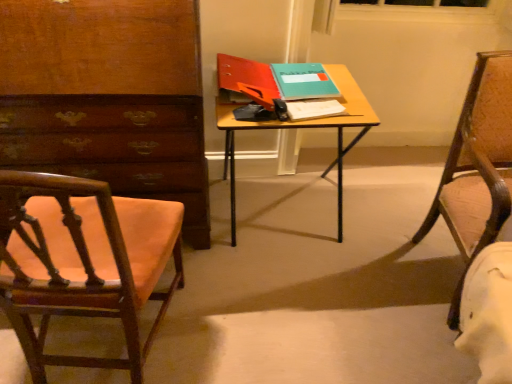
What do you see at coordinates (477, 167) in the screenshot?
I see `leather-like brown chair at right, which is the second chair from left to right` at bounding box center [477, 167].

Find the location of `matte red folder at center, which is the first book in left-to-right order`. matte red folder at center, which is the first book in left-to-right order is located at coordinates (243, 73).

Where is `teal matte book at center, the 2th book from the left`? This screenshot has width=512, height=384. teal matte book at center, the 2th book from the left is located at coordinates tap(303, 81).

Is leather-like brown chair at right, the first chair from the right, shorter than wooden chair at left, marked as the 2th chair in a right-to-left arrangement?

In fact, leather-like brown chair at right, the first chair from the right, may be taller than wooden chair at left, marked as the 2th chair in a right-to-left arrangement.

Is leather-like brown chair at right, the first chair from the right, thinner than wooden chair at left, marked as the 2th chair in a right-to-left arrangement?

In fact, leather-like brown chair at right, the first chair from the right, might be wider than wooden chair at left, marked as the 2th chair in a right-to-left arrangement.

From the image's perspective, is leather-like brown chair at right, the first chair from the right, located beneath wooden chair at left, acting as the first chair starting from the left?

No, from the image's perspective, leather-like brown chair at right, the first chair from the right, is not beneath wooden chair at left, acting as the first chair starting from the left.

Is leather-like brown chair at right, the first chair from the right, bigger than wooden chair at left, acting as the first chair starting from the left?

Yes, leather-like brown chair at right, the first chair from the right, is bigger than wooden chair at left, acting as the first chair starting from the left.

From the image's perspective, is teal matte book at center, acting as the 1th book starting from the right, located above or below matte red folder at center, the 2th book viewed from the right?

Clearly, from the image's perspective, teal matte book at center, acting as the 1th book starting from the right, is above matte red folder at center, the 2th book viewed from the right.

Could matte red folder at center, which is the first book in left-to-right order, be considered to be inside teal matte book at center, the 2th book from the left?

No, matte red folder at center, which is the first book in left-to-right order, is not inside teal matte book at center, the 2th book from the left.

Is teal matte book at center, acting as the 1th book starting from the right, not close to matte red folder at center, which is the first book in left-to-right order?

No, teal matte book at center, acting as the 1th book starting from the right, is in close proximity to matte red folder at center, which is the first book in left-to-right order.

From the picture: From a real-world perspective, is teal matte book at center, acting as the 1th book starting from the right, positioned under matte red folder at center, the 2th book viewed from the right, based on gravity?

Correct, in the physical world, teal matte book at center, acting as the 1th book starting from the right, is lower than matte red folder at center, the 2th book viewed from the right.

Between matte red folder at center, the 2th book viewed from the right, and wooden desk at center, which one is positioned behind?

matte red folder at center, the 2th book viewed from the right, is further away from the camera.

Locate an element on the screen. the 1st book behind the wooden desk at center, counting from the anchor's position is located at coordinates (243, 73).

From the picture: In terms of height, does matte red folder at center, which is the first book in left-to-right order, look taller or shorter compared to wooden desk at center?

In the image, matte red folder at center, which is the first book in left-to-right order, appears to be shorter than wooden desk at center.

Based on the photo, how far apart are matte red folder at center, the 2th book viewed from the right, and white paper notepad at center?

A distance of 9.64 inches exists between matte red folder at center, the 2th book viewed from the right, and white paper notepad at center.

Is point (247, 83) more distant than point (331, 105)?

Yes.

Between matte red folder at center, which is the first book in left-to-right order, and white paper notepad at center, which one has more height?

With more height is matte red folder at center, which is the first book in left-to-right order.

From a real-world perspective, is matte red folder at center, which is the first book in left-to-right order, positioned under white paper notepad at center based on gravity?

No, from a real-world perspective, matte red folder at center, which is the first book in left-to-right order, is not below white paper notepad at center.

Is the depth of matte red folder at center, the 2th book viewed from the right, greater than that of wooden chair at left, acting as the first chair starting from the left?

Yes, matte red folder at center, the 2th book viewed from the right, is behind wooden chair at left, acting as the first chair starting from the left.

Based on the photo, is matte red folder at center, the 2th book viewed from the right, thinner than wooden chair at left, marked as the 2th chair in a right-to-left arrangement?

Indeed, matte red folder at center, the 2th book viewed from the right, has a lesser width compared to wooden chair at left, marked as the 2th chair in a right-to-left arrangement.

Is matte red folder at center, which is the first book in left-to-right order, not near wooden chair at left, marked as the 2th chair in a right-to-left arrangement?

matte red folder at center, which is the first book in left-to-right order, is actually quite close to wooden chair at left, marked as the 2th chair in a right-to-left arrangement.

Between matte red folder at center, which is the first book in left-to-right order, and teal matte book at center, the 2th book from the left, which one is positioned in front?

matte red folder at center, which is the first book in left-to-right order.

Considering the sizes of objects matte red folder at center, which is the first book in left-to-right order, and teal matte book at center, acting as the 1th book starting from the right, in the image provided, who is wider, matte red folder at center, which is the first book in left-to-right order, or teal matte book at center, acting as the 1th book starting from the right,?

matte red folder at center, which is the first book in left-to-right order, is wider.

Could you measure the distance between matte red folder at center, the 2th book viewed from the right, and teal matte book at center, the 2th book from the left?

The distance of matte red folder at center, the 2th book viewed from the right, from teal matte book at center, the 2th book from the left, is 5.04 inches.

In the scene shown: How different are the orientations of teal matte book at center, acting as the 1th book starting from the right, and white paper notepad at center in degrees?

The angular difference between teal matte book at center, acting as the 1th book starting from the right, and white paper notepad at center is 8.08 degrees.

From a real-world perspective, between teal matte book at center, the 2th book from the left, and white paper notepad at center, who is vertically lower?

white paper notepad at center is physically lower.

Relative to white paper notepad at center, is teal matte book at center, the 2th book from the left, in front or behind?

teal matte book at center, the 2th book from the left, is positioned farther from the viewer than white paper notepad at center.

Measure the distance from teal matte book at center, acting as the 1th book starting from the right, to white paper notepad at center.

A distance of 12.37 centimeters exists between teal matte book at center, acting as the 1th book starting from the right, and white paper notepad at center.

Where is `chair on the left of leather-like brown chair at right, the first chair from the right`? The width and height of the screenshot is (512, 384). chair on the left of leather-like brown chair at right, the first chair from the right is located at coordinates (83, 261).

Where is `book positioned vertically above the teal matte book at center, acting as the 1th book starting from the right (from a real-world perspective)`? This screenshot has height=384, width=512. book positioned vertically above the teal matte book at center, acting as the 1th book starting from the right (from a real-world perspective) is located at coordinates (243, 73).

Which object lies further to the anchor point matte red folder at center, which is the first book in left-to-right order, wooden chair at left, marked as the 2th chair in a right-to-left arrangement, or leather-like brown chair at right, which is the second chair from left to right?

Based on the image, leather-like brown chair at right, which is the second chair from left to right, appears to be further to matte red folder at center, which is the first book in left-to-right order.

Considering their positions, is leather-like brown chair at right, which is the second chair from left to right, positioned further to white paper notepad at center than matte red folder at center, the 2th book viewed from the right?

leather-like brown chair at right, which is the second chair from left to right, lies further to white paper notepad at center than the other object.

Looking at the image, which one is located further to white paper notepad at center, matte red folder at center, which is the first book in left-to-right order, or leather-like brown chair at right, the first chair from the right?

leather-like brown chair at right, the first chair from the right, lies further to white paper notepad at center than the other object.

Based on the photo, based on their spatial positions, is wooden desk at center or white paper notepad at center closer to leather-like brown chair at right, which is the second chair from left to right?

The object closer to leather-like brown chair at right, which is the second chair from left to right, is wooden desk at center.

From the image, which object appears to be nearer to wooden chair at left, marked as the 2th chair in a right-to-left arrangement, leather-like brown chair at right, the first chair from the right, or teal matte book at center, acting as the 1th book starting from the right?

teal matte book at center, acting as the 1th book starting from the right, is closer to wooden chair at left, marked as the 2th chair in a right-to-left arrangement.

Based on their spatial positions, is matte red folder at center, which is the first book in left-to-right order, or wooden desk at center closer to teal matte book at center, the 2th book from the left?

The object closer to teal matte book at center, the 2th book from the left, is matte red folder at center, which is the first book in left-to-right order.

Looking at the image, which one is located closer to white paper notepad at center, teal matte book at center, acting as the 1th book starting from the right, or wooden chair at left, acting as the first chair starting from the left?

teal matte book at center, acting as the 1th book starting from the right, is positioned closer to the anchor white paper notepad at center.

Based on their spatial positions, is leather-like brown chair at right, which is the second chair from left to right, or wooden chair at left, marked as the 2th chair in a right-to-left arrangement, closer to matte red folder at center, which is the first book in left-to-right order?

Based on the image, wooden chair at left, marked as the 2th chair in a right-to-left arrangement, appears to be nearer to matte red folder at center, which is the first book in left-to-right order.

Where is `notepad between teal matte book at center, the 2th book from the left, and wooden desk at center in the up-down direction`? The height and width of the screenshot is (384, 512). notepad between teal matte book at center, the 2th book from the left, and wooden desk at center in the up-down direction is located at coordinates (314, 109).

The height and width of the screenshot is (384, 512). I want to click on book located between wooden desk at center and leather-like brown chair at right, which is the second chair from left to right, in the left-right direction, so click(x=303, y=81).

Where is `desk located between wooden chair at left, marked as the 2th chair in a right-to-left arrangement, and leather-like brown chair at right, the first chair from the right, in the left-right direction`? This screenshot has height=384, width=512. desk located between wooden chair at left, marked as the 2th chair in a right-to-left arrangement, and leather-like brown chair at right, the first chair from the right, in the left-right direction is located at coordinates (300, 128).

I want to click on desk between wooden chair at left, marked as the 2th chair in a right-to-left arrangement, and white paper notepad at center, so click(300, 128).